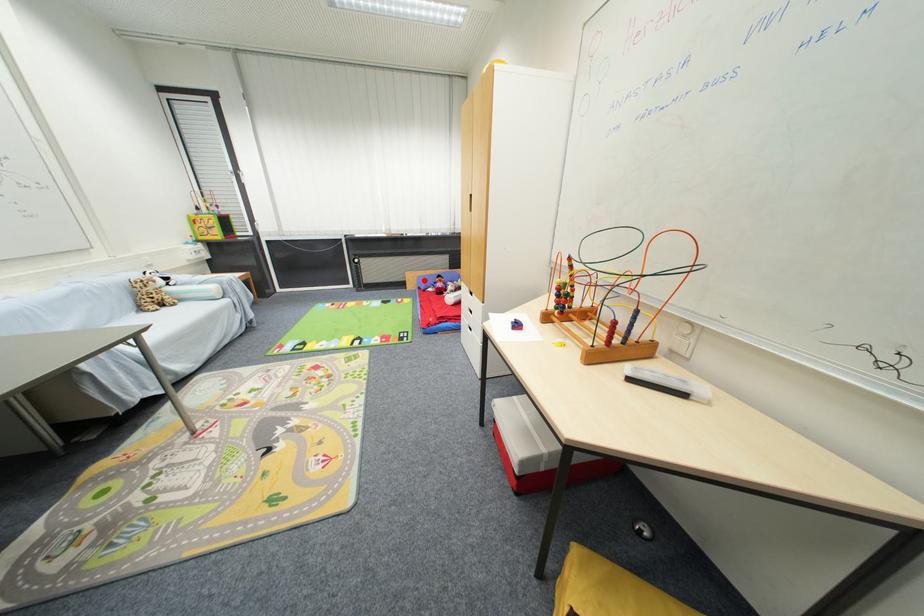
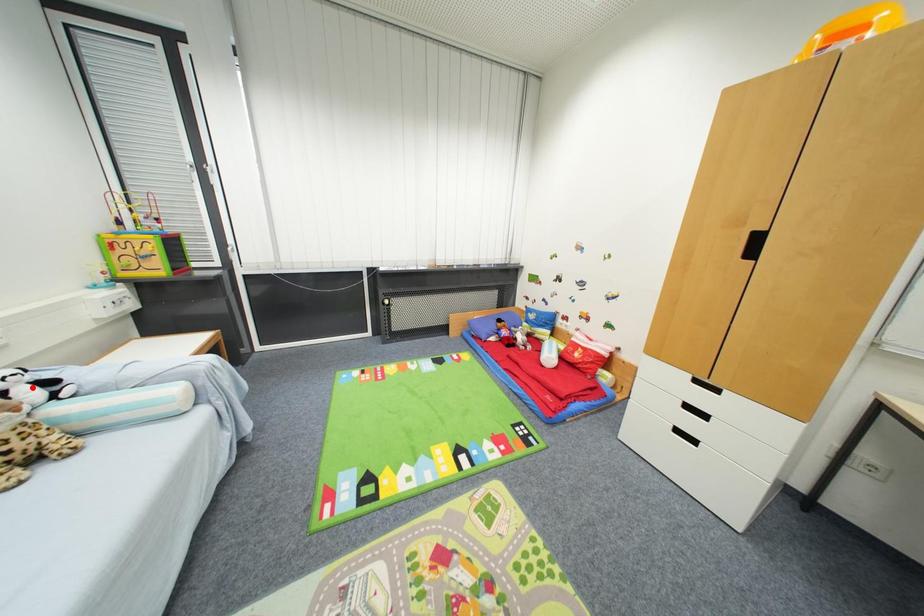
I am providing you with two images of the same scene from different viewpoints. A red point is marked on the first image and another point is marked on the second image. Are the points marked in image1 and image2 representing the same 3D position?

No